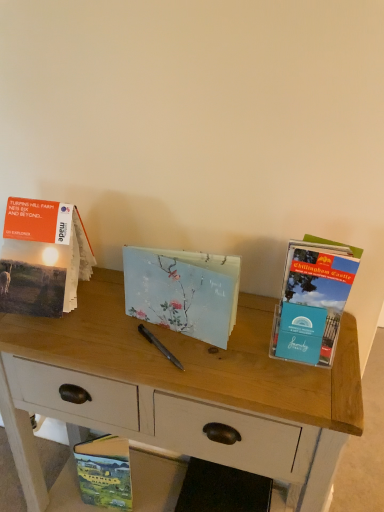
The height and width of the screenshot is (512, 384). I want to click on vacant space to the right of matte paper book at left, acting as the 4th book starting from the right, so click(x=116, y=321).